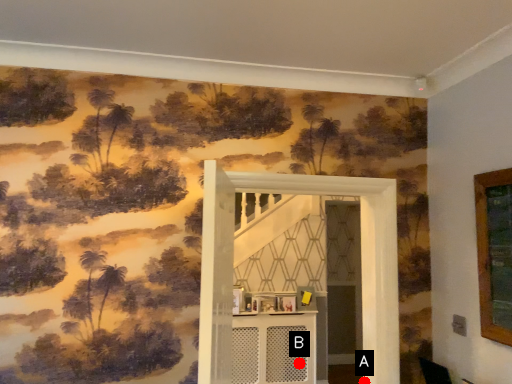
Question: Two points are circled on the image, labeled by A and B beside each circle. Which point is closer to the camera taking this photo?

Choices:
 (A) A is closer
 (B) B is closer

Answer: (A)